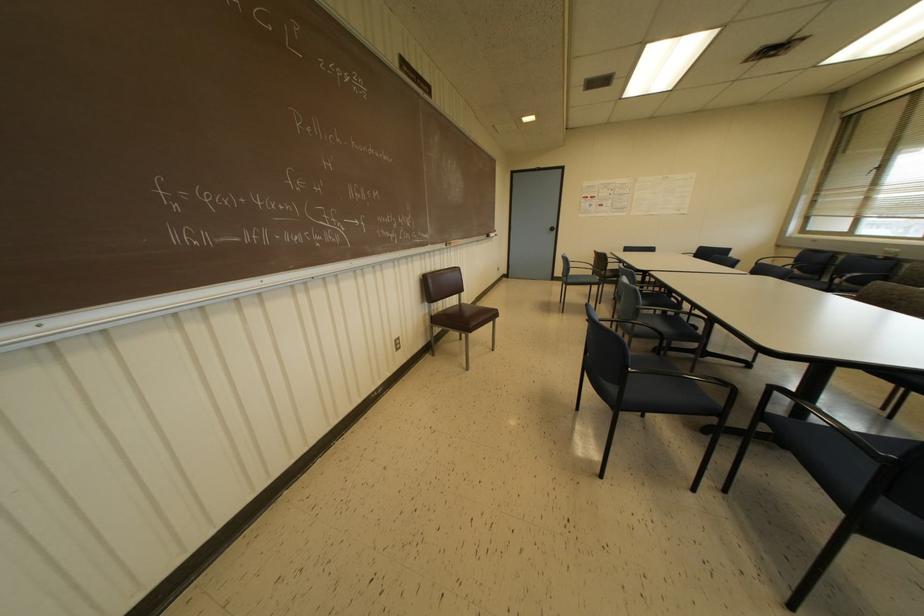
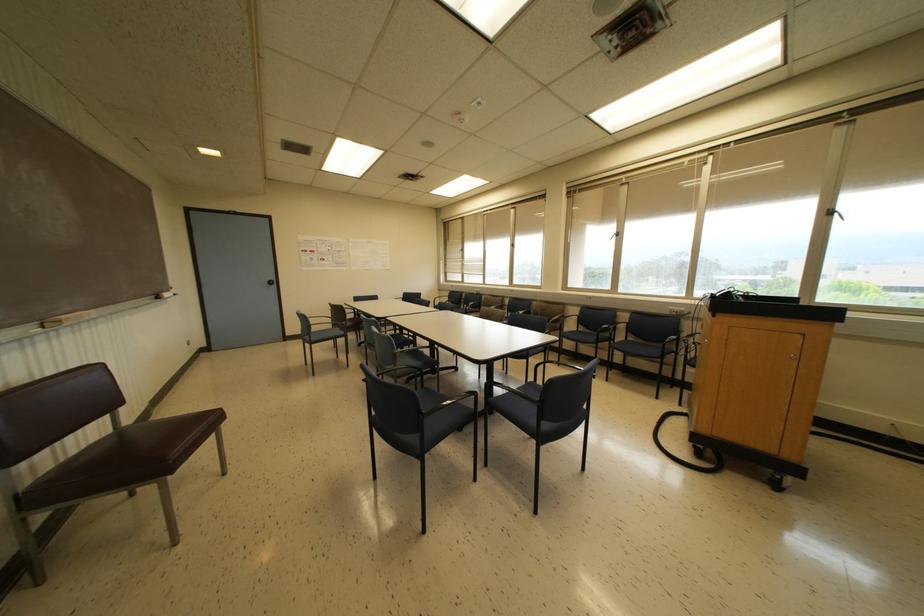
Locate, in the second image, the point that corresponds to (568,280) in the first image.

(312, 338)